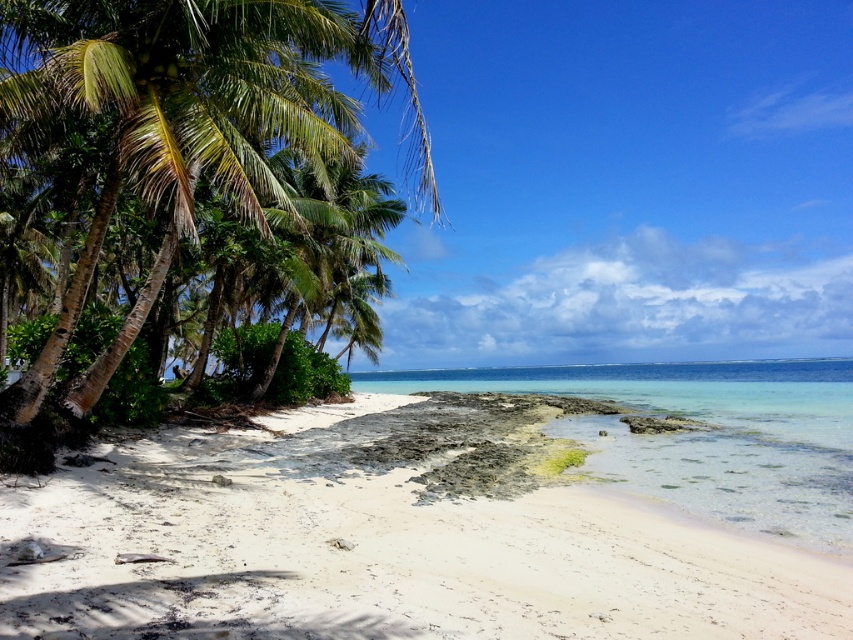
Question: Which point appears farthest from the camera in this image?

Choices:
 (A) (231, 179)
 (B) (151, 566)

Answer: (A)

Question: Considering the real-world distances, which object is farthest from the clear sand at lower center?

Choices:
 (A) green leafy palm tree at left
 (B) white sandy beach at lower left

Answer: (B)

Question: Which object is positioned closest to the white sandy beach at lower left?

Choices:
 (A) green leafy palm tree at left
 (B) clear sand at lower center

Answer: (A)

Question: Is white sandy beach at lower left below green leafy palm tree at left?

Choices:
 (A) yes
 (B) no

Answer: (A)

Question: Is green leafy palm tree at left below clear sand at lower center?

Choices:
 (A) yes
 (B) no

Answer: (B)

Question: Is white sandy beach at lower left below clear sand at lower center?

Choices:
 (A) no
 (B) yes

Answer: (A)